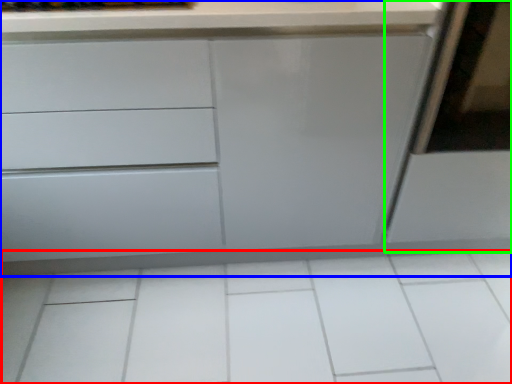
Question: Based on their relative distances, which object is farther from ceramic tile (highlighted by a red box)? Choose from chest of drawers (highlighted by a blue box) and screen door (highlighted by a green box).

Choices:
 (A) chest of drawers
 (B) screen door

Answer: (B)